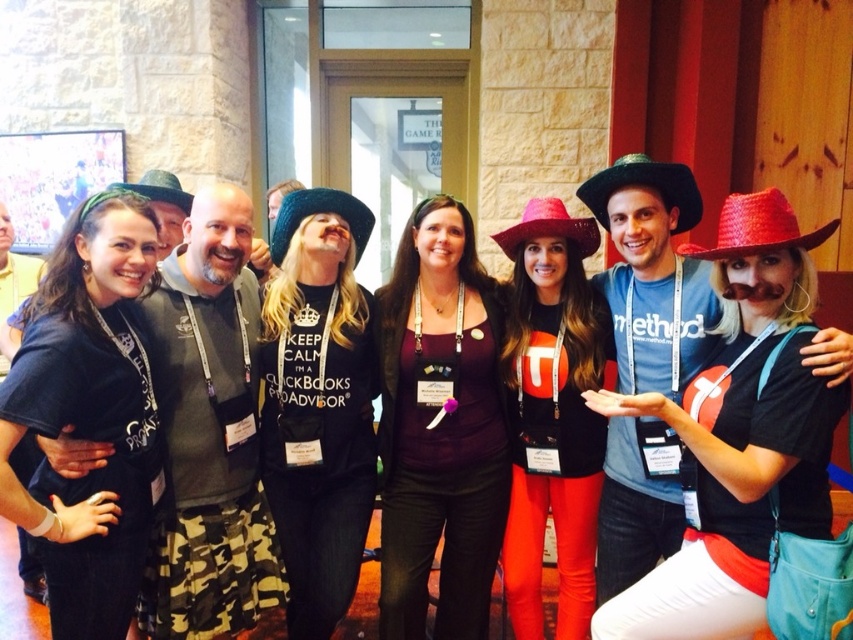
You are organizing a photo shoot and need to ensure that the red straw cowboy hat at upper right and the green felt cowboy hat at center are positioned at least 12 inches apart for the camera to capture both clearly. Based on the scene description, will their current positions meet this requirement?

The red straw cowboy hat at upper right is 13.61 inches from the green felt cowboy hat at center, which exceeds the 12 inch requirement. Therefore, their current positions meet the requirement.

You are standing in the lobby and see two points in the image. The first point is at coordinates point (807, 234) and the second point is at coordinates point (677, 180). Which point is closer to you?

Point (807, 234) is closer to the viewer than point (677, 180).